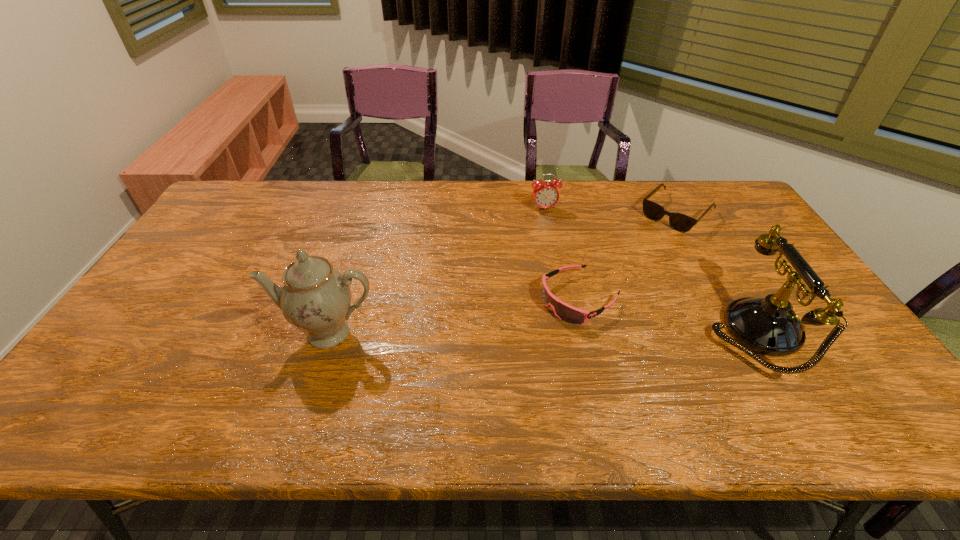
The image size is (960, 540). What are the coordinates of `free spot on the desktop that is between the chinaware and the second tallest object and is positioned at the front lenses of the sunglasses` in the screenshot? It's located at (553, 333).

Where is `vacant space on the desktop that is between the leftmost object and the telephone and is positioned on the front-facing side of the goggles`? The height and width of the screenshot is (540, 960). vacant space on the desktop that is between the leftmost object and the telephone and is positioned on the front-facing side of the goggles is located at coordinates (516, 333).

I want to click on free space on the desktop that is between the leftmost object and the telephone and is positioned on the face of the third tallest object, so click(588, 333).